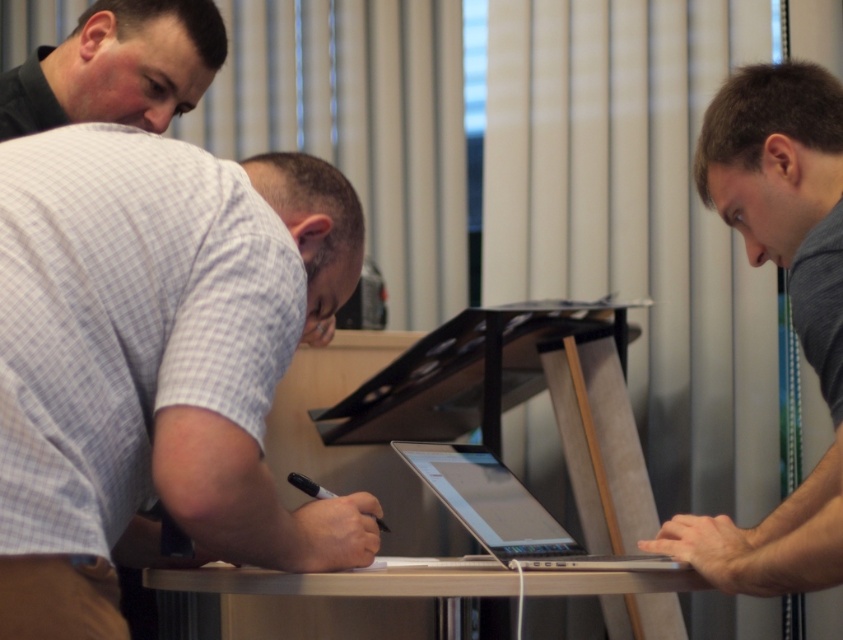
You are standing in the room and see the point at coordinates (117,67). Which object from the scene does this point belong to?

The point at coordinates (117,67) belongs to the black shirt at upper left.

You are organizing a meeting in a room with a silver metallic table at center and a silver metallic laptop at center. If you need to place a large presentation binder next to the laptop, will there be enough space on the table?

The silver metallic table at center is wider than the silver metallic laptop at center, so there should be enough space to place the large presentation binder next to the laptop.

You are a person sitting at the table in the scene. You need to reach for the gray matte laptop at center without moving your chair. Can you estimate if your hand can reach it based on its position?

The gray matte laptop at center is positioned at coordinates point (x=790, y=301), which would likely be within reach if you extend your arm, so yes, your hand can probably reach it without moving your chair.